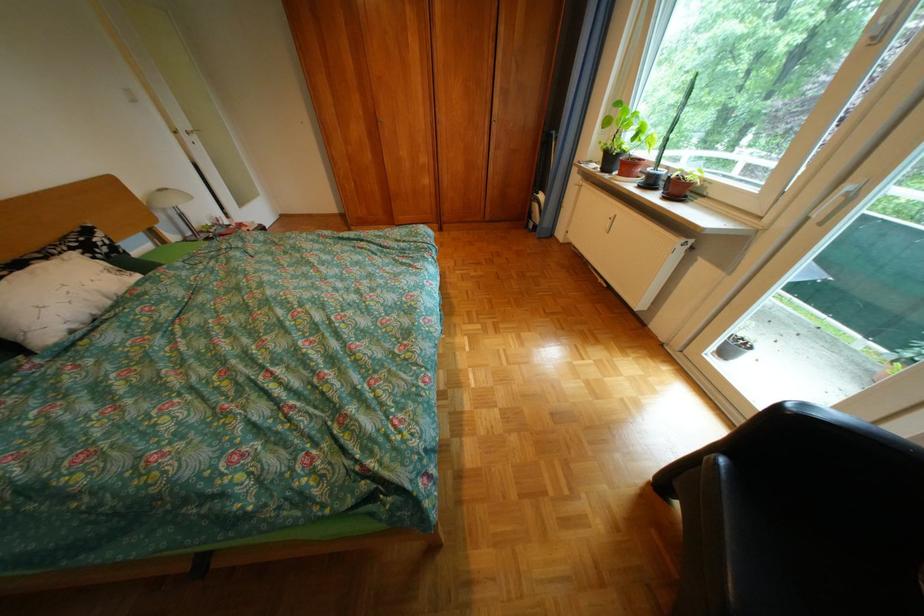
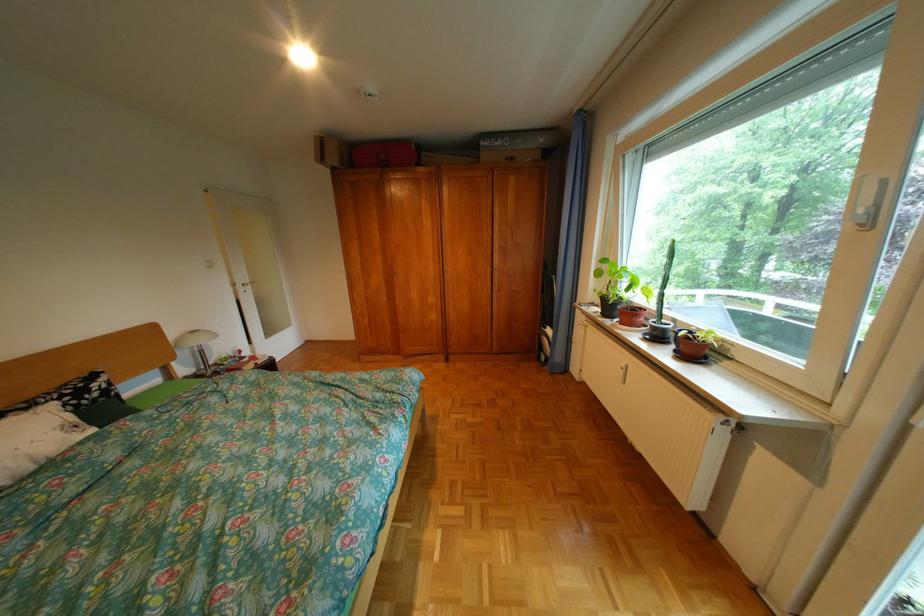
Find the pixel in the second image that matches (646,187) in the first image.

(650, 338)